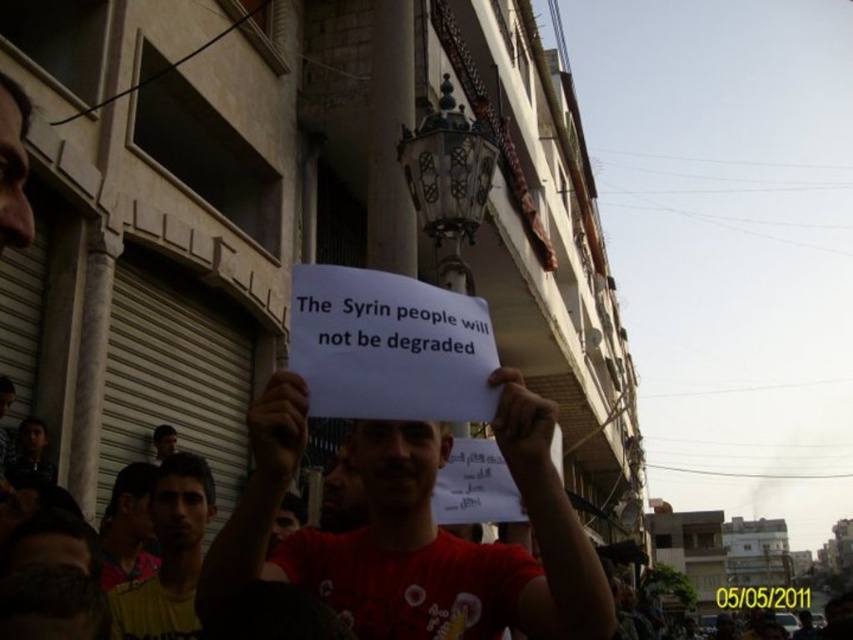
Question: Which of the following is the farthest from the observer?

Choices:
 (A) yellow printed shirt at lower left
 (B) white paper at center

Answer: (A)

Question: Can you confirm if white paper at center is positioned to the left of yellow printed shirt at lower left?

Choices:
 (A) yes
 (B) no

Answer: (B)

Question: In this image, where is white paper at center located relative to yellow printed shirt at lower left?

Choices:
 (A) below
 (B) above

Answer: (B)

Question: Is white paper at center wider than yellow printed shirt at lower left?

Choices:
 (A) yes
 (B) no

Answer: (A)

Question: Which object appears closest to the camera in this image?

Choices:
 (A) yellow printed shirt at lower left
 (B) white paper at center

Answer: (B)